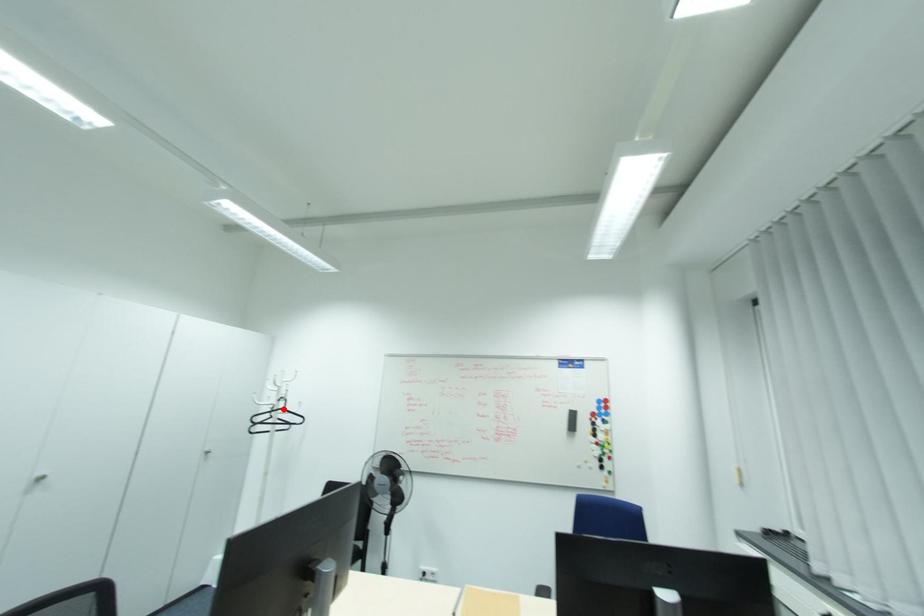
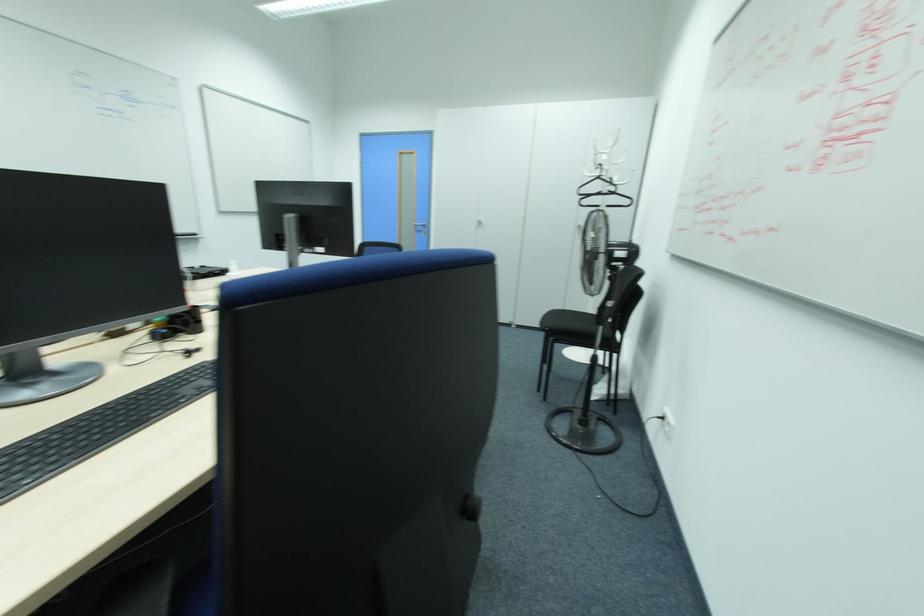
Where in the second image is the point corresponding to the highlighted location from the first image?

(599, 177)